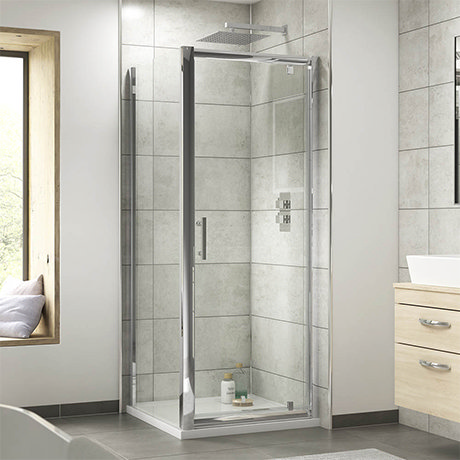
Locate an element on the screen. floor is located at coordinates (292, 432).